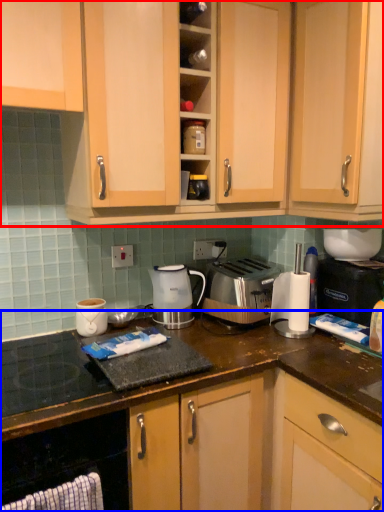
Question: Which object is closer to the camera taking this photo, cabinetry (highlighted by a red box) or cabinetry (highlighted by a blue box)?

Choices:
 (A) cabinetry
 (B) cabinetry

Answer: (B)